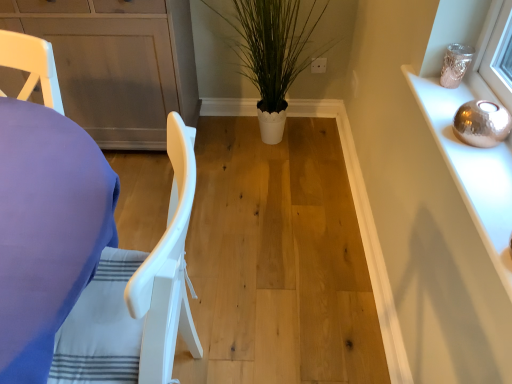
Question: In the image, is green leafy plant at center on the left side or the right side of matte gray cabinet at center, which is the second cabinetry from front to back?

Choices:
 (A) left
 (B) right

Answer: (B)

Question: Considering their positions, is green leafy plant at center located in front of or behind matte gray cabinet at center, which is the 1th cabinetry from left to right?

Choices:
 (A) front
 (B) behind

Answer: (A)

Question: Which object is the closest to the silver metallic sphere at upper right, the first cabinetry viewed from the right?

Choices:
 (A) green leafy plant at center
 (B) matte gray cabinet at center, which is the 1th cabinetry from left to right
 (C) white plastic chair at left

Answer: (C)

Question: Which of these objects is positioned farthest from the green leafy plant at center?

Choices:
 (A) white plastic chair at left
 (B) silver metallic sphere at upper right, which is counted as the second cabinetry, starting from the back
 (C) matte gray cabinet at center, which is the 1th cabinetry from left to right

Answer: (A)